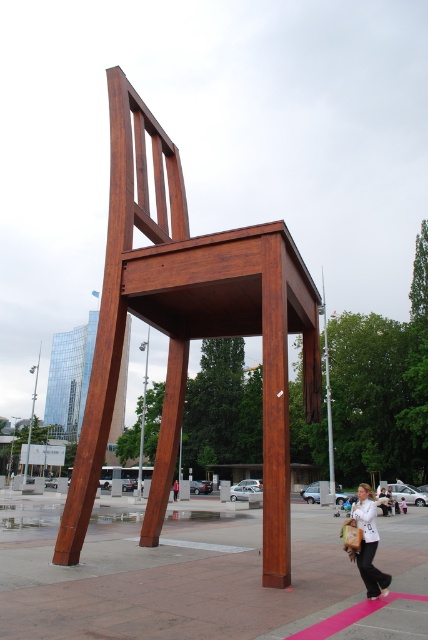
Question: Which object is positioned closest to the white fabric bag at lower center?

Choices:
 (A) white cotton shirt at lower right
 (B) wooden chair at center

Answer: (A)

Question: Which point is farther from the camera taking this photo?

Choices:
 (A) coord(142,257)
 (B) coord(372,572)
 (C) coord(175,486)

Answer: (C)

Question: Which object is the farthest from the white cotton shirt at lower right?

Choices:
 (A) white fabric bag at lower center
 (B) wooden chair at center

Answer: (A)

Question: Is wooden chair at center to the left of white fabric bag at lower center from the viewer's perspective?

Choices:
 (A) no
 (B) yes

Answer: (A)

Question: Can you confirm if wooden chair at center is positioned above white fabric bag at lower center?

Choices:
 (A) no
 (B) yes

Answer: (B)

Question: Considering the relative positions of white cotton shirt at lower right and white fabric bag at lower center in the image provided, where is white cotton shirt at lower right located with respect to white fabric bag at lower center?

Choices:
 (A) left
 (B) right

Answer: (B)